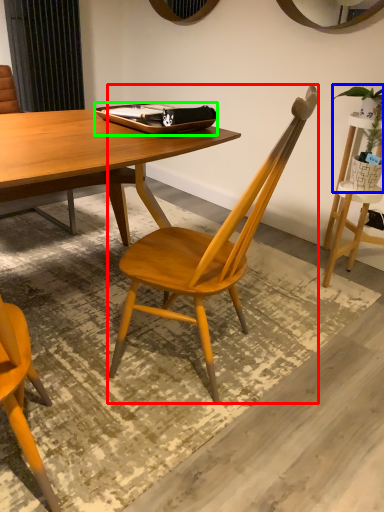
Question: Based on their relative distances, which object is farther from chair (highlighted by a red box)? Choose from houseplant (highlighted by a blue box) and tray (highlighted by a green box).

Choices:
 (A) houseplant
 (B) tray

Answer: (A)